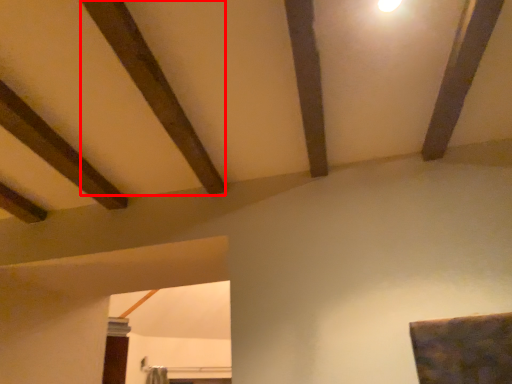
Question: From the image's perspective, what is the correct spatial positioning of plank (annotated by the red box) in reference to plank?

Choices:
 (A) below
 (B) above

Answer: (A)